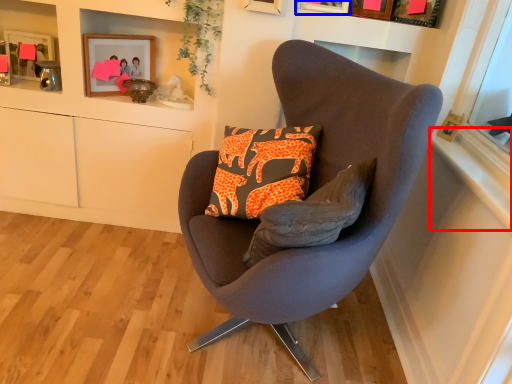
Question: Which object is closer to the camera taking this photo, window sill (highlighted by a red box) or picture frame (highlighted by a blue box)?

Choices:
 (A) window sill
 (B) picture frame

Answer: (A)